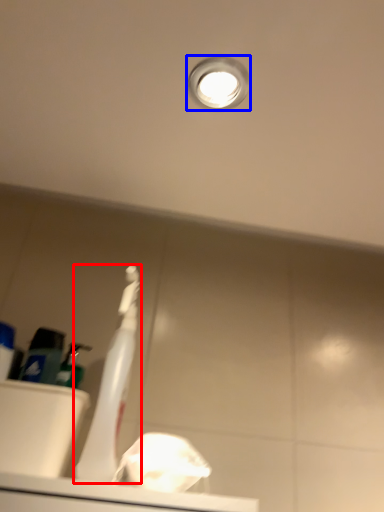
Question: Which object is closer to the camera taking this photo, toothbrush (highlighted by a red box) or droplight (highlighted by a blue box)?

Choices:
 (A) toothbrush
 (B) droplight

Answer: (A)